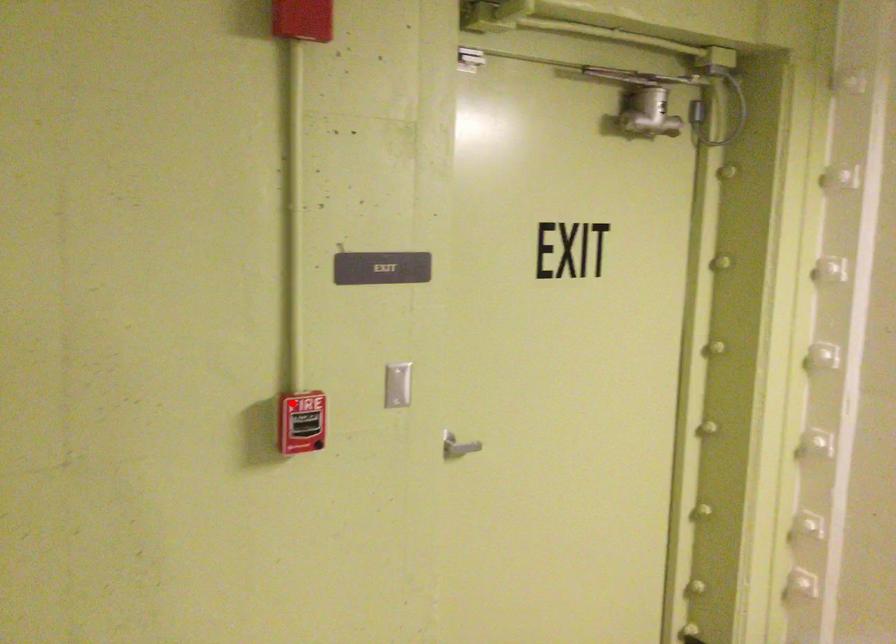
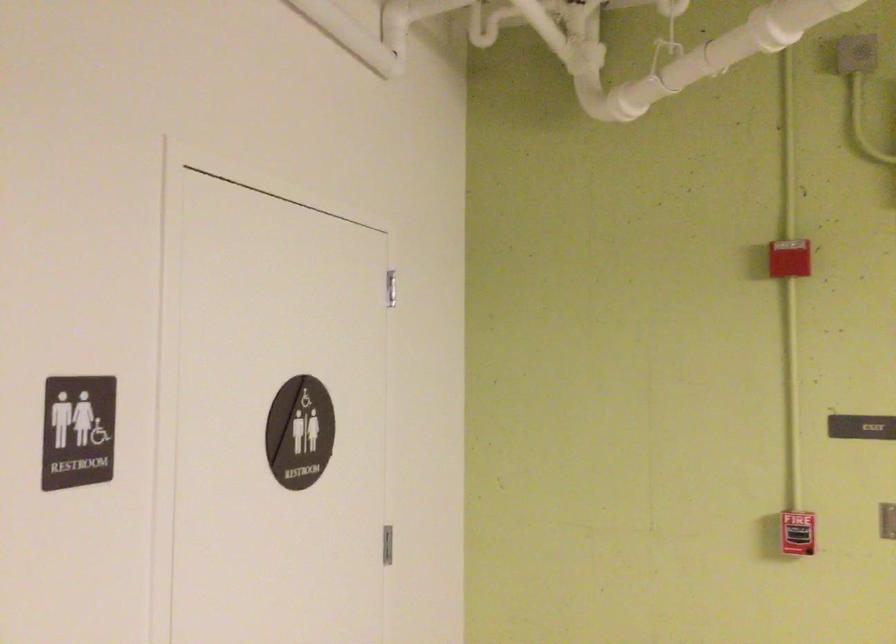
In the second image, find the point that corresponds to the highlighted location in the first image.

(797, 533)